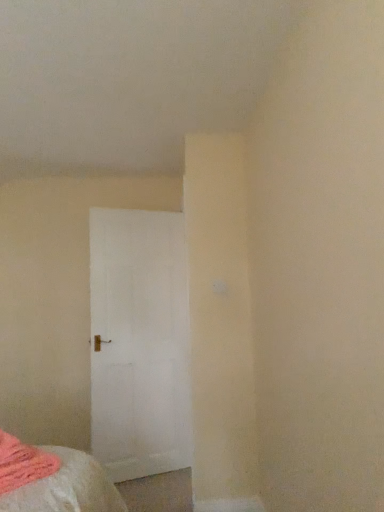
Question: In the image, is soft pink fabric at lower left on the left side or the right side of white matte door at center?

Choices:
 (A) left
 (B) right

Answer: (A)

Question: Is soft pink fabric at lower left wider or thinner than white matte door at center?

Choices:
 (A) wide
 (B) thin

Answer: (A)

Question: From the image's perspective, is soft pink fabric at lower left located above or below white matte door at center?

Choices:
 (A) above
 (B) below

Answer: (B)

Question: Looking at their shapes, would you say white matte door at center is wider or thinner than soft pink fabric at lower left?

Choices:
 (A) thin
 (B) wide

Answer: (A)

Question: Is point (183, 376) positioned closer to the camera than point (21, 474)?

Choices:
 (A) closer
 (B) farther

Answer: (B)

Question: Looking at the image, does white matte door at center seem bigger or smaller compared to soft pink fabric at lower left?

Choices:
 (A) small
 (B) big

Answer: (B)

Question: From their relative heights in the image, would you say white matte door at center is taller or shorter than soft pink fabric at lower left?

Choices:
 (A) tall
 (B) short

Answer: (A)